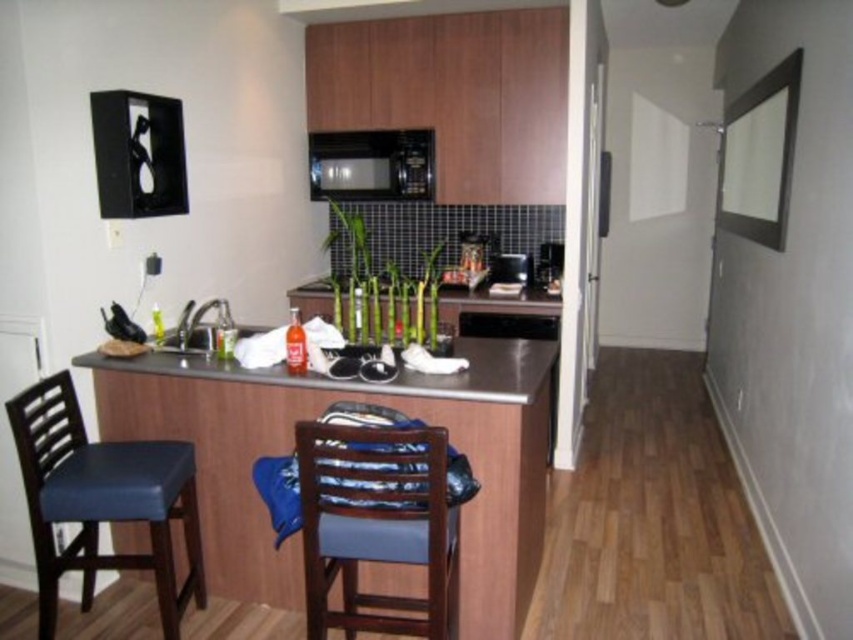
Question: Which of the following is the closest to the observer?

Choices:
 (A) blue leather chair at left
 (B) stainless steel counter at center
 (C) matte stainless steel sink at center

Answer: (A)

Question: Can you confirm if blue leather chair at left is positioned above black matte microwave at upper center?

Choices:
 (A) no
 (B) yes

Answer: (A)

Question: Which point is farther to the camera?

Choices:
 (A) (183, 321)
 (B) (398, 168)
 (C) (531, 268)
 (D) (163, 502)

Answer: (C)

Question: Which point appears closest to the camera in this image?

Choices:
 (A) (486, 515)
 (B) (44, 496)
 (C) (207, 372)
 (D) (310, 195)

Answer: (B)

Question: Can you confirm if blue leather chair at left is smaller than black matte microwave at upper center?

Choices:
 (A) yes
 (B) no

Answer: (B)

Question: Can you confirm if blue leather chair at left is positioned to the left of stainless steel counter at center?

Choices:
 (A) no
 (B) yes

Answer: (B)